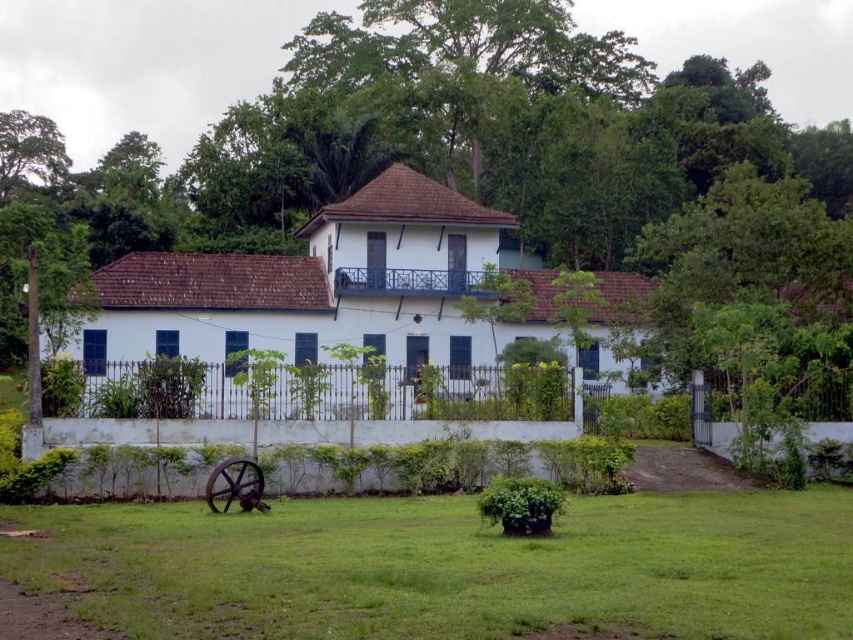
Where is `green grass at lower center`? green grass at lower center is located at coordinates (448, 566).

Describe the element at coordinates (448, 566) in the screenshot. The image size is (853, 640). I see `green grass at lower center` at that location.

Does point (310, 506) come farther from viewer compared to point (15, 177)?

No.

Locate an element on the screen. The width and height of the screenshot is (853, 640). green grass at lower center is located at coordinates (448, 566).